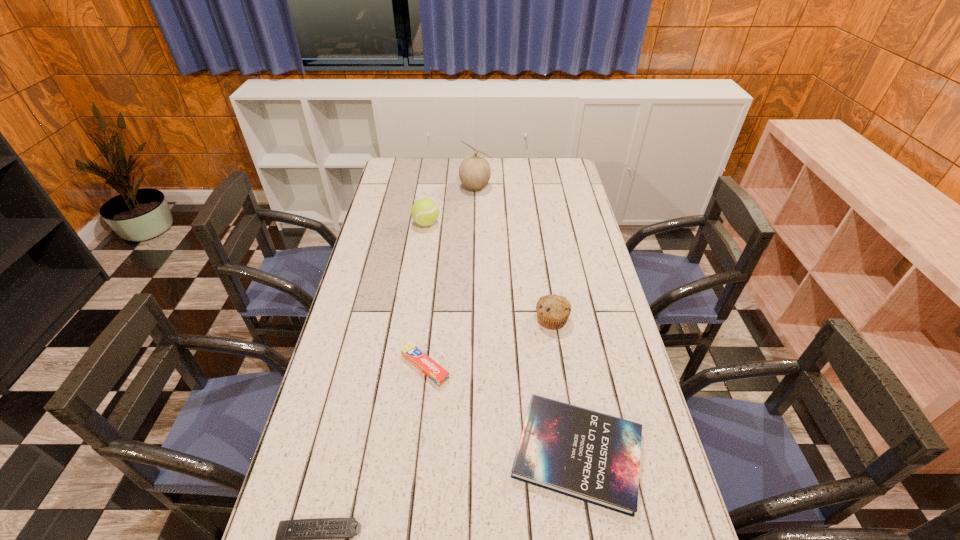
Locate an element on the screen. This screenshot has width=960, height=540. vacant area in the image that satisfies the following two spatial constraints: 1. on the front side of the second nearest object; 2. on the right side of the cantaloup is located at coordinates (473, 453).